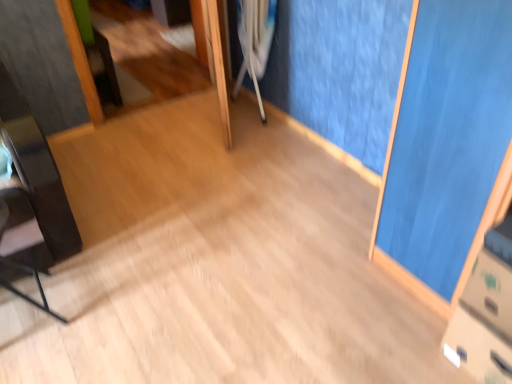
Where is `spots to the right of matte black chair at left`? spots to the right of matte black chair at left is located at coordinates (94, 313).